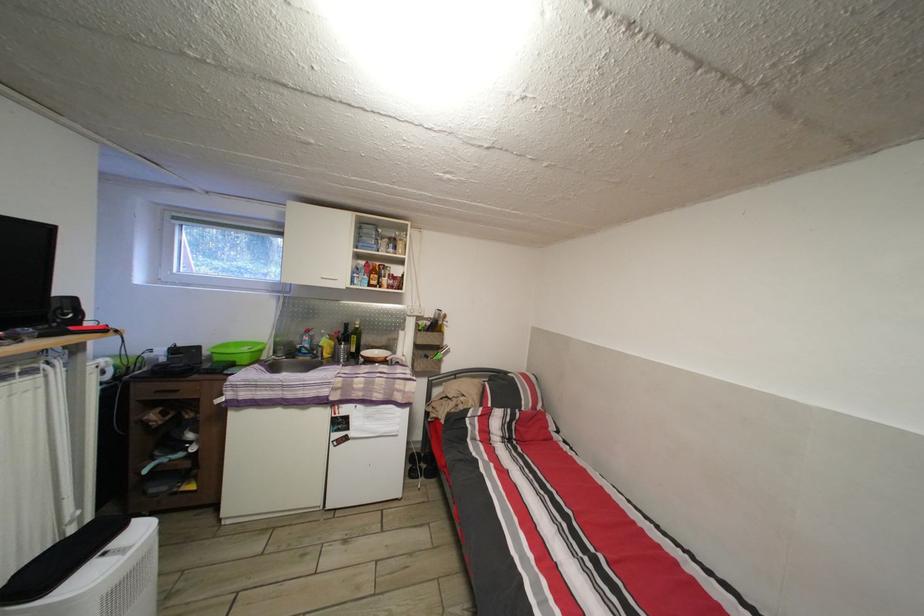
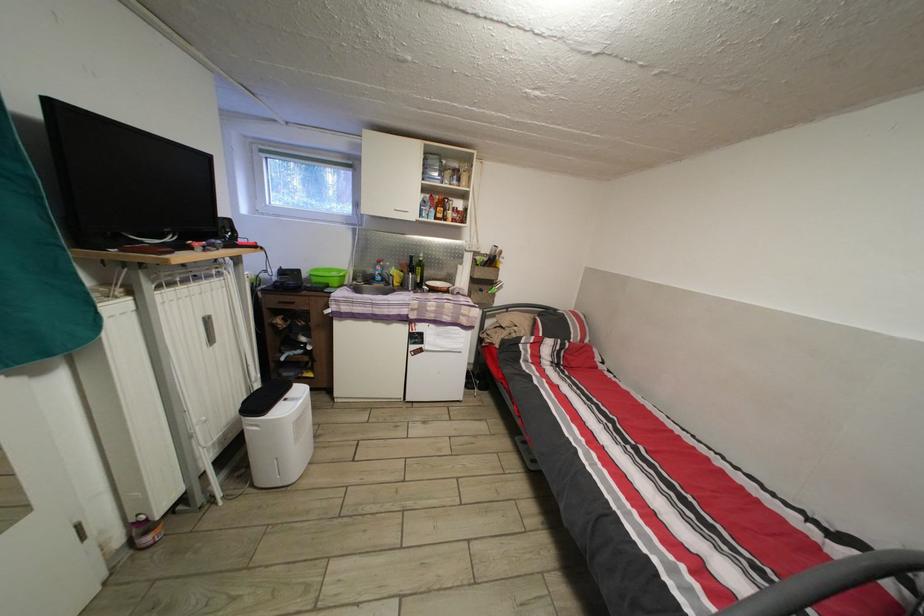
The point at (319, 344) is marked in the first image. Where is the corresponding point in the second image?

(390, 274)